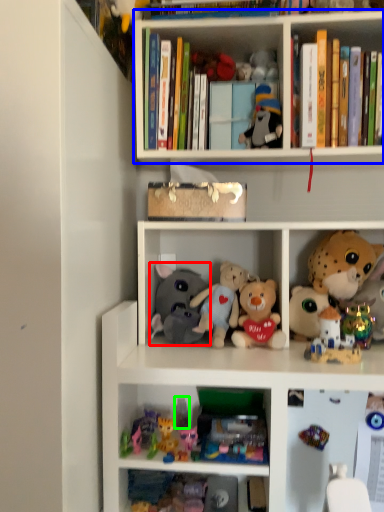
Question: Based on their relative distances, which object is farther from toy (highlighted by a red box)? Choose from shelf (highlighted by a blue box) and toy (highlighted by a green box).

Choices:
 (A) shelf
 (B) toy

Answer: (A)